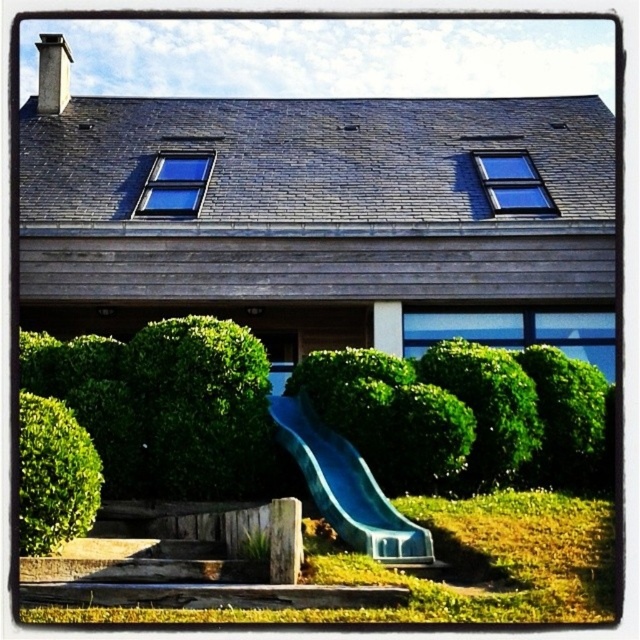
The image size is (640, 640). What do you see at coordinates (346, 486) in the screenshot? I see `blue plastic slide at center` at bounding box center [346, 486].

Which is more to the right, blue plastic slide at center or green leafy bush at lower left?

blue plastic slide at center is more to the right.

Locate an element on the screen. This screenshot has height=640, width=640. blue plastic slide at center is located at coordinates (346, 486).